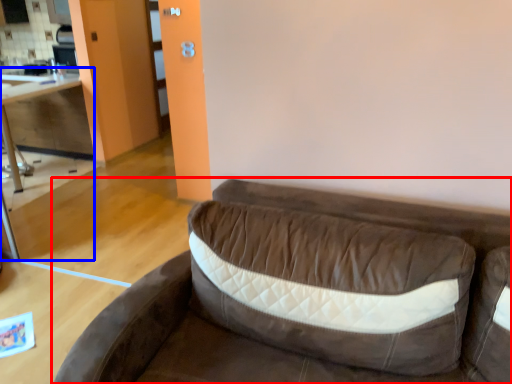
Question: Which object is closer to the camera taking this photo, studio couch (highlighted by a red box) or table (highlighted by a blue box)?

Choices:
 (A) studio couch
 (B) table

Answer: (A)